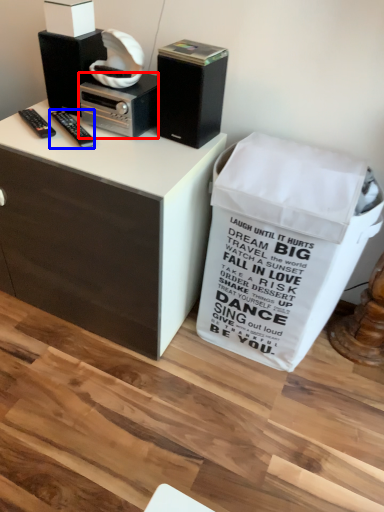
Question: Which object appears farthest to the camera in this image, appliance (highlighted by a red box) or remote control (highlighted by a blue box)?

Choices:
 (A) appliance
 (B) remote control

Answer: (A)